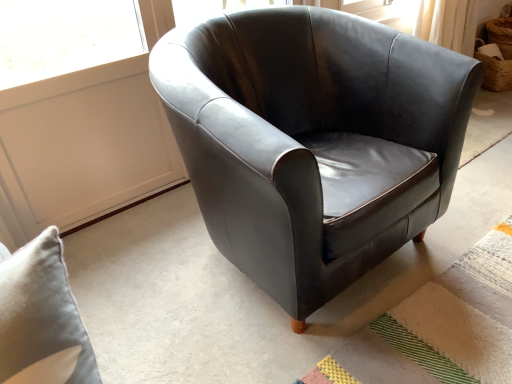
Where is `matte black armchair at center`? This screenshot has height=384, width=512. matte black armchair at center is located at coordinates (309, 138).

The width and height of the screenshot is (512, 384). What do you see at coordinates (309, 138) in the screenshot?
I see `matte black armchair at center` at bounding box center [309, 138].

The image size is (512, 384). Find the location of `textured woven mat at lower right`. textured woven mat at lower right is located at coordinates (438, 327).

The height and width of the screenshot is (384, 512). Describe the element at coordinates (438, 327) in the screenshot. I see `textured woven mat at lower right` at that location.

Locate an element on the screen. matte black armchair at center is located at coordinates (309, 138).

Does matte black armchair at center appear on the left side of textured woven mat at lower right?

Yes.

Relative to textured woven mat at lower right, is matte black armchair at center in front or behind?

In the image, matte black armchair at center appears in front of textured woven mat at lower right.

Which is behind, point (367, 30) or point (421, 308)?

The point (367, 30) is more distant.

From the image's perspective, is matte black armchair at center located above or below textured woven mat at lower right?

Based on their image positions, matte black armchair at center is located above textured woven mat at lower right.

From a real-world perspective, is matte black armchair at center on top of textured woven mat at lower right?

Correct, in the physical world, matte black armchair at center is higher than textured woven mat at lower right.

Is matte black armchair at center wider or thinner than textured woven mat at lower right?

In the image, matte black armchair at center appears to be more narrow than textured woven mat at lower right.

Is matte black armchair at center taller than textured woven mat at lower right?

Correct, matte black armchair at center is much taller as textured woven mat at lower right.

Considering the sizes of objects matte black armchair at center and textured woven mat at lower right in the image provided, who is bigger, matte black armchair at center or textured woven mat at lower right?

With larger size is matte black armchair at center.

Looking at this image, is matte black armchair at center positioned beyond the bounds of textured woven mat at lower right?

Yes, matte black armchair at center is located beyond the bounds of textured woven mat at lower right.

Are matte black armchair at center and textured woven mat at lower right located far from each other?

matte black armchair at center is actually quite close to textured woven mat at lower right.

Does matte black armchair at center turn towards textured woven mat at lower right?

Yes, matte black armchair at center is facing textured woven mat at lower right.

What's the angular difference between matte black armchair at center and textured woven mat at lower right's facing directions?

The facing directions of matte black armchair at center and textured woven mat at lower right are 88.3 degrees apart.

Where is `chair on the left side of textured woven mat at lower right`? The height and width of the screenshot is (384, 512). chair on the left side of textured woven mat at lower right is located at coordinates (309, 138).

Is textured woven mat at lower right to the right of matte black armchair at center from the viewer's perspective?

Yes.

Considering the relative positions of textured woven mat at lower right and matte black armchair at center in the image provided, is textured woven mat at lower right in front of matte black armchair at center?

No, textured woven mat at lower right is further to the viewer.

Consider the image. Which point is more forward, (416, 324) or (292, 29)?

The point (416, 324) is closer to the camera.

Based on the photo, from the image's perspective, who appears lower, textured woven mat at lower right or matte black armchair at center?

textured woven mat at lower right appears lower in the image.

From a real-world perspective, does textured woven mat at lower right stand above matte black armchair at center?

No, from a real-world perspective, textured woven mat at lower right is not on top of matte black armchair at center.

In the scene shown: Is textured woven mat at lower right wider or thinner than matte black armchair at center?

textured woven mat at lower right is wider than matte black armchair at center.

Does textured woven mat at lower right have a lesser height compared to matte black armchair at center?

Correct, textured woven mat at lower right is not as tall as matte black armchair at center.

Is textured woven mat at lower right bigger or smaller than matte black armchair at center?

textured woven mat at lower right is smaller than matte black armchair at center.

Is textured woven mat at lower right surrounding matte black armchair at center?

No, matte black armchair at center is located outside of textured woven mat at lower right.

Is textured woven mat at lower right not near matte black armchair at center?

No, textured woven mat at lower right is not far away from matte black armchair at center.

Could you tell me if textured woven mat at lower right is facing matte black armchair at center?

No, textured woven mat at lower right is not oriented towards matte black armchair at center.

How many degrees apart are the facing directions of textured woven mat at lower right and matte black armchair at center?

88.3 degrees separate the facing orientations of textured woven mat at lower right and matte black armchair at center.

I want to click on mat located on the right of matte black armchair at center, so click(x=438, y=327).

The width and height of the screenshot is (512, 384). I want to click on chair in front of the textured woven mat at lower right, so click(309, 138).

The width and height of the screenshot is (512, 384). Find the location of `chair that appears above the textured woven mat at lower right (from a real-world perspective)`. chair that appears above the textured woven mat at lower right (from a real-world perspective) is located at coordinates (309, 138).